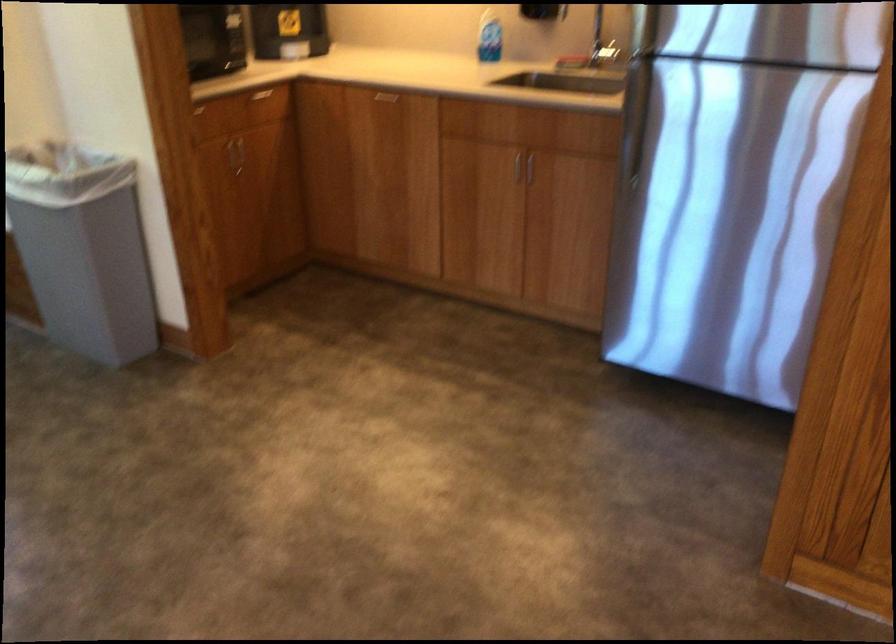
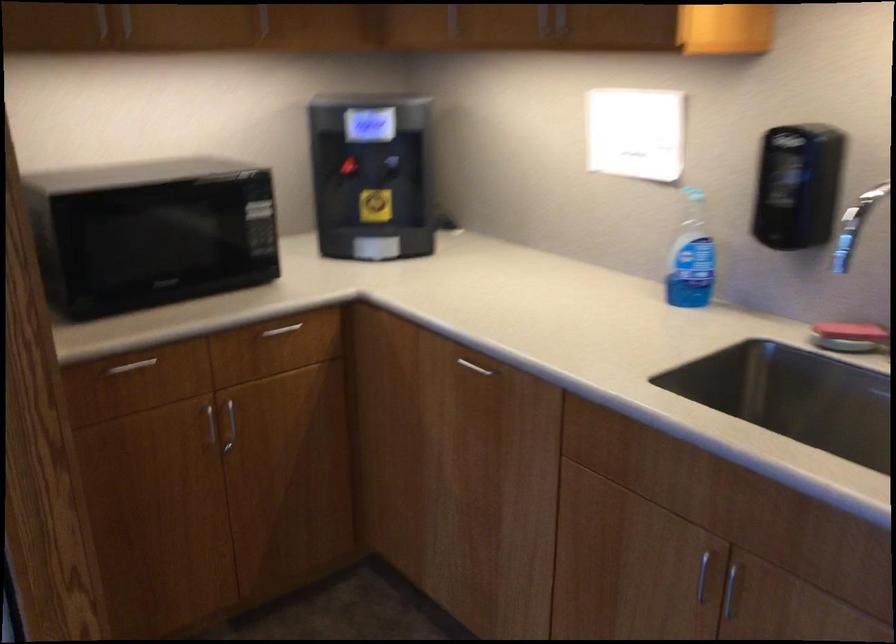
The point at (530,172) is marked in the first image. Where is the corresponding point in the second image?

(729, 590)